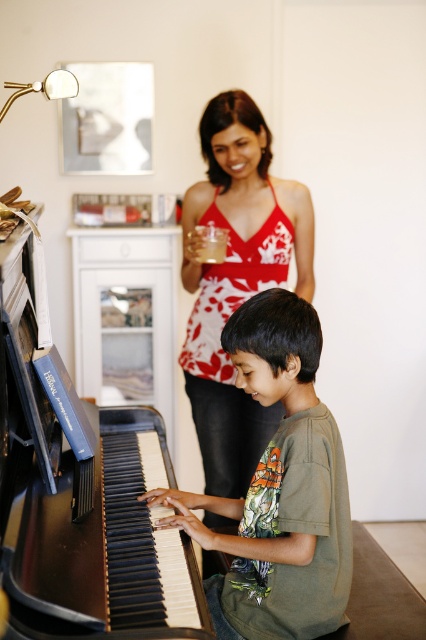
Question: Which point is farther to the camera?

Choices:
 (A) green cotton shirt at center
 (B) red floral tank top at center
 (C) black polished piano at left

Answer: (B)

Question: Can you confirm if black polished piano at left is thinner than green cotton shirt at center?

Choices:
 (A) yes
 (B) no

Answer: (B)

Question: Does green cotton shirt at center lie behind red floral tank top at center?

Choices:
 (A) no
 (B) yes

Answer: (A)

Question: Which object is the closest to the red floral tank top at center?

Choices:
 (A) green cotton shirt at center
 (B) black polished piano at left

Answer: (A)

Question: Which point is closer to the camera?

Choices:
 (A) (25, 333)
 (B) (316, 564)
 (C) (201, 438)

Answer: (A)

Question: Is black polished piano at left to the left of red floral tank top at center from the viewer's perspective?

Choices:
 (A) no
 (B) yes

Answer: (B)